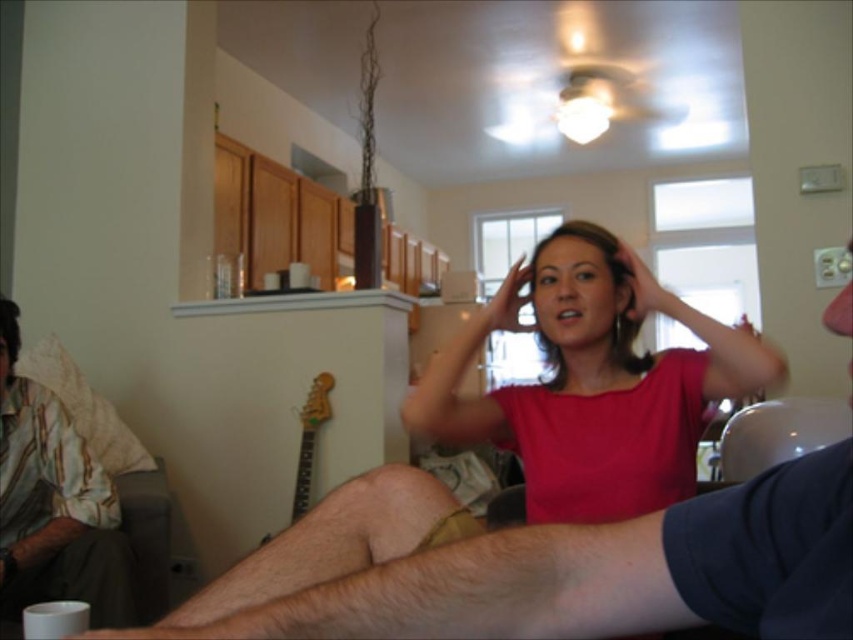
Who is more forward, (537, 326) or (106, 500)?

Positioned in front is point (537, 326).

Is point (672, 294) farther from viewer compared to point (33, 426)?

No, it is in front of (33, 426).

Which is behind, point (657, 397) or point (76, 557)?

The point (76, 557) is behind.

The image size is (853, 640). I want to click on pink matte shirt at center, so click(593, 381).